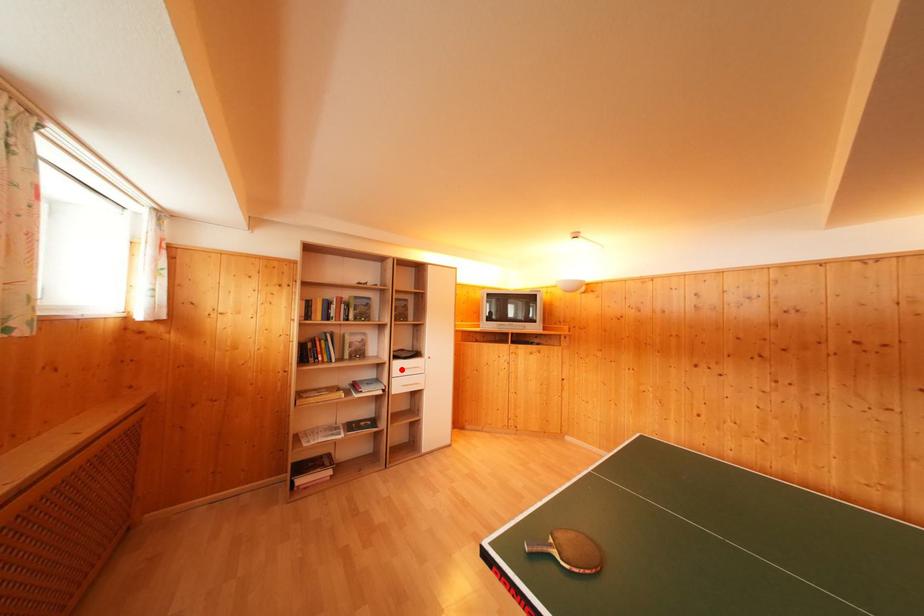
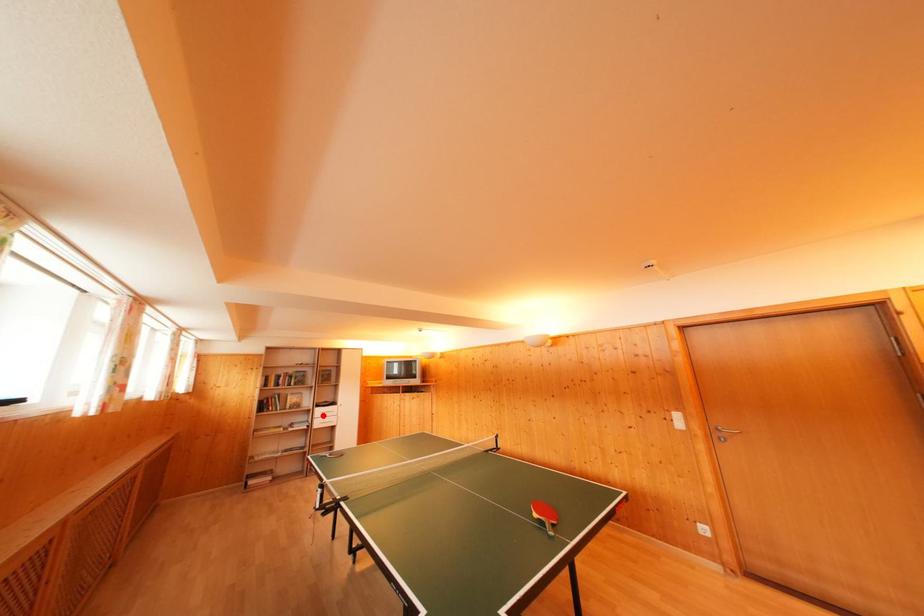
I am providing you with two images of the same scene from different viewpoints. A red point is marked on the first image and another point is marked on the second image. Is the red point in image1 aligned with the point shown in image2?

Yes